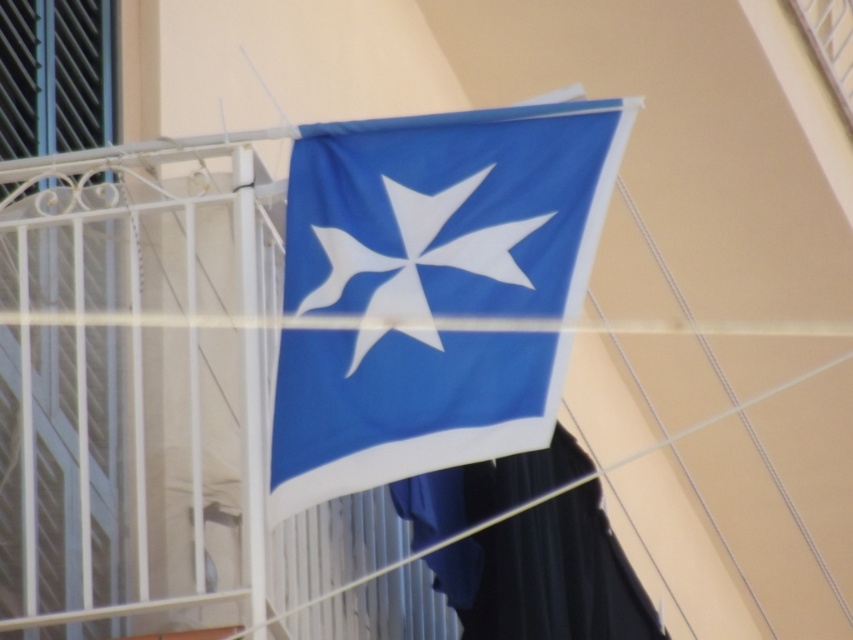
You are standing on the balcony looking at the flag. There are two points marked on the flag. Which point is closer to you, point [505,172] or point [431,262]?

Point [505,172] is closer to you than point [431,262] because it is further to the viewer according to the description.

You are standing on the balcony and want to hang a new flag. The current flag is at point (451,211). Where should you place the new flag so it is centered on the railing?

The blue fabric flag at center is already at point (451,211), so placing the new flag at the same coordinates would center it on the railing.

You are standing on the balcony looking at the blue fabric flag at center and the white fabric star at center. Which object is closer to you?

The blue fabric flag at center is closer to you because the white fabric star at center is behind it.